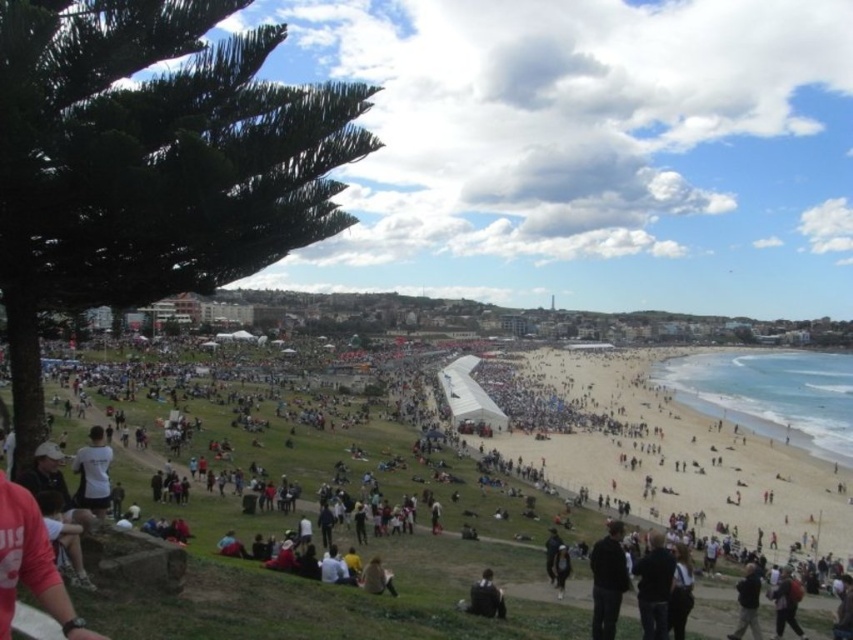
You are a photographer standing at the edge of the grassy area near the tree. You want to take a photo of both the dark gray jacket at lower center and the dark brown leather jacket at lower center without any obstructions. Which jacket should you position closer to the camera to ensure both are visible?

The dark gray jacket at lower center is closer to the viewer than the dark brown leather jacket at lower center, so positioning the dark gray jacket closer to the camera will ensure both jackets are visible without obstructions.

You are a photographer at the beach event and need to capture a group photo. You notice two people wearing a white cotton shirt at lower left and a dark brown leather jacket at lower center. Which clothing item would appear bigger in your photo?

The white cotton shirt at lower left would appear bigger in the photo since it has a larger size compared to the dark brown leather jacket at lower center.